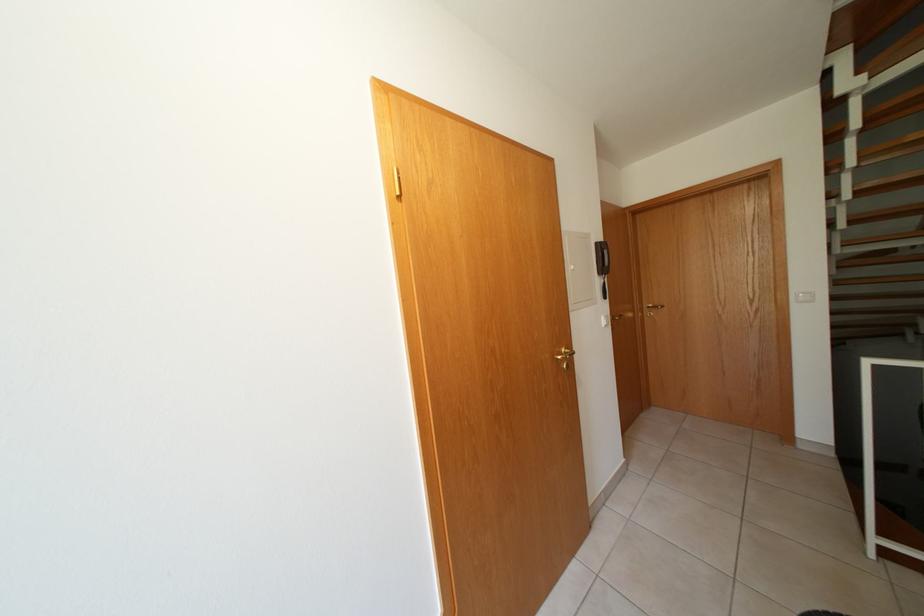
Find where to lift the intercom handset. Please return your answer as a coordinate pair (x, y).

(602, 265)